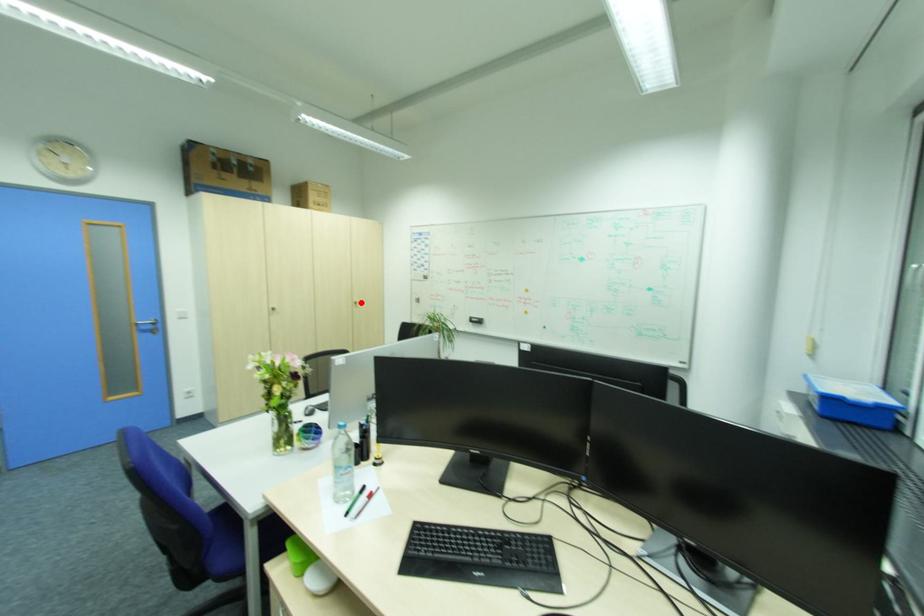
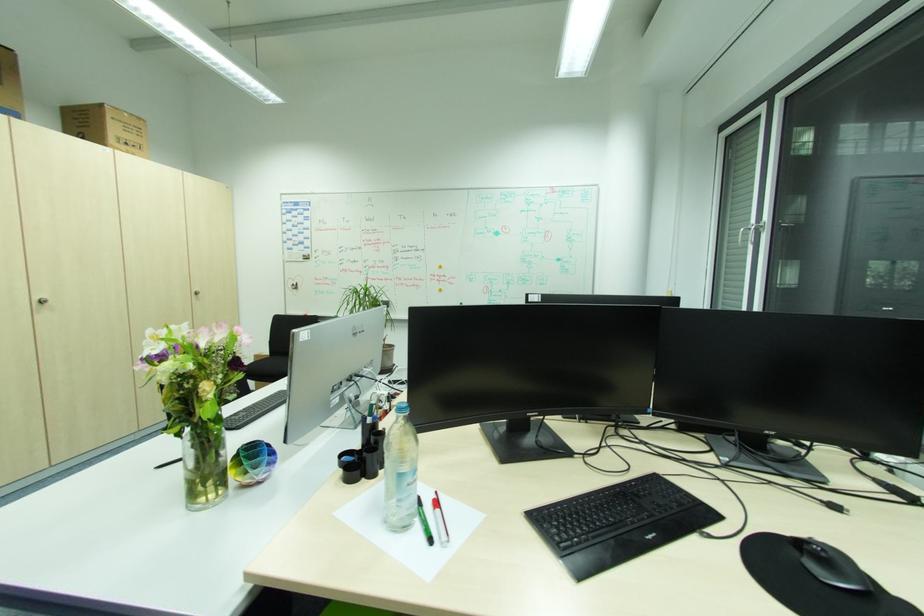
In the second image, find the point that corresponds to the highlighted location in the first image.

(202, 293)